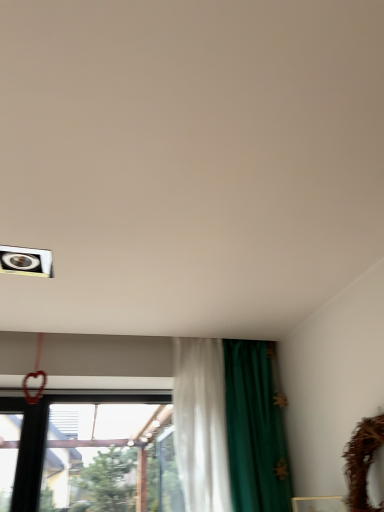
What do you see at coordinates (319, 504) in the screenshot? I see `white glossy window sill at lower center` at bounding box center [319, 504].

What is the approximate width of white glossy window sill at lower center?

The width of white glossy window sill at lower center is 1.81 inches.

I want to click on white glossy window sill at lower center, so click(319, 504).

This screenshot has width=384, height=512. In order to click on white glossy window sill at lower center in this screenshot , I will do `click(319, 504)`.